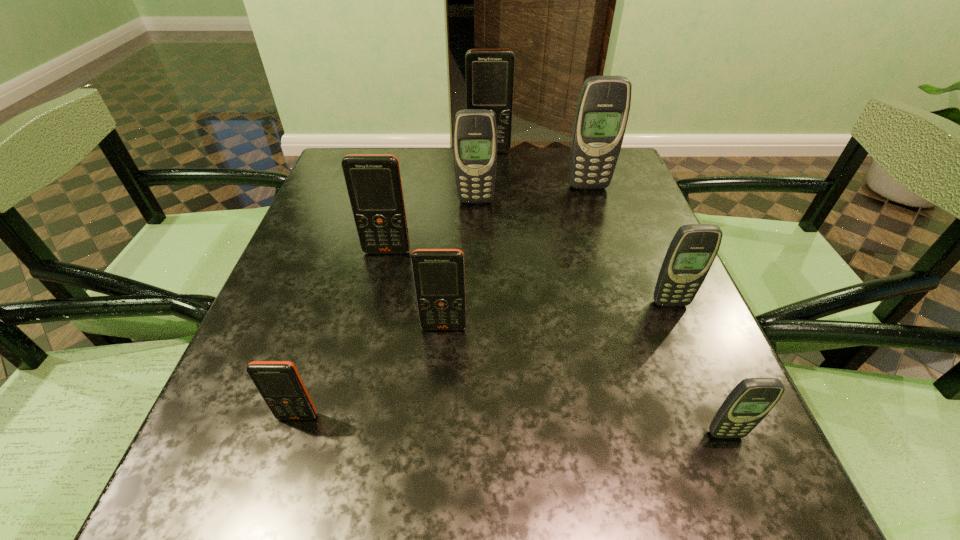
Locate an element on the screen. Image resolution: width=960 pixels, height=540 pixels. blank region between the smallest gray cellular telephone and the third nearest gray cellular telephone is located at coordinates (601, 318).

Locate an element on the screen. object that is the seventh nearest to the second farthest orange cellular telephone is located at coordinates (752, 399).

You are a GUI agent. You are given a task and a screenshot of the screen. Output one action in this format:
    pyautogui.click(x=<x>, y=<y>)
    Task: Click on the object that is the closest one to the third biggest orange cellular telephone
    
    Given the screenshot: What is the action you would take?
    pyautogui.click(x=373, y=181)

Where is `cellular telephone that is the second nearest to the farthest cellular telephone`? This screenshot has width=960, height=540. cellular telephone that is the second nearest to the farthest cellular telephone is located at coordinates (475, 134).

Identify which cellular telephone is the second nearest to the farthest object. Please provide its 2D coordinates. Your answer should be formatted as a tuple, i.e. [(x, y)], where the tuple contains the x and y coordinates of a point satisfying the conditions above.

[(475, 134)]

What are the coordinates of `orange cellular telephone that is the closest one to the second nearest cellular telephone` in the screenshot? It's located at (439, 275).

Find the location of `orange cellular telephone object that ranks as the third closest to the leftmost gray cellular telephone`. orange cellular telephone object that ranks as the third closest to the leftmost gray cellular telephone is located at coordinates (439, 275).

In order to click on gray cellular telephone object that ranks as the fourth closest to the sixth farthest cellular telephone in this screenshot , I will do `click(602, 112)`.

Locate which gray cellular telephone is the third closest to the farthest object. Please provide its 2D coordinates. Your answer should be formatted as a tuple, i.e. [(x, y)], where the tuple contains the x and y coordinates of a point satisfying the conditions above.

[(692, 251)]